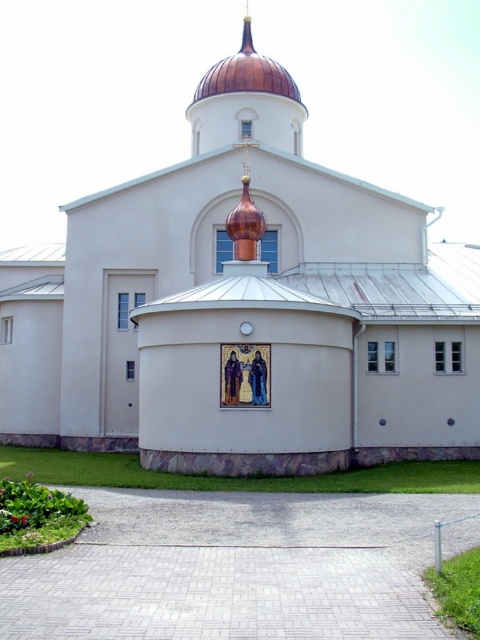
Who is higher up, white matte church at center or copper dome at upper center?

Positioned higher is copper dome at upper center.

Is point (213, 180) closer to camera compared to point (291, 152)?

Yes.

Identify the location of white matte church at center. This screenshot has width=480, height=640. (243, 308).